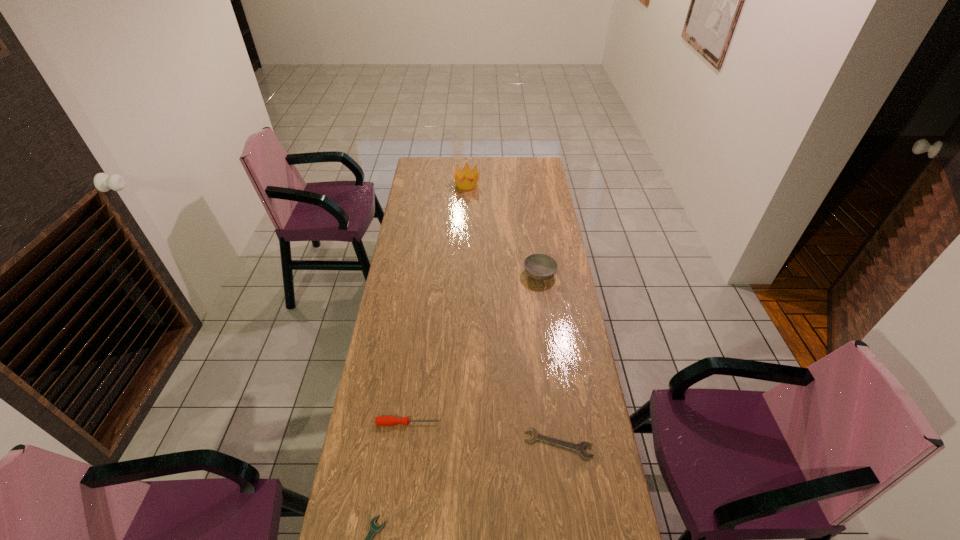
At what (x,y) coordinates should I click in order to perform the action: click on free location located at the tip of the third tallest object. Please return your answer as a coordinate pair (x, y). This screenshot has width=960, height=540. Looking at the image, I should click on (519, 423).

Locate an element on the screen. free space located on the front of the farther wrench is located at coordinates (568, 520).

I want to click on object present at the far edge, so click(466, 173).

At what (x,y) coordinates should I click in order to perform the action: click on object that is at the left edge. Please return your answer as a coordinate pair (x, y). Looking at the image, I should click on (380, 420).

Find the location of a particular element. bowl that is at the right edge is located at coordinates click(539, 266).

The image size is (960, 540). I want to click on wrench at the right edge, so click(580, 447).

Identify the location of vacant point at the far edge. This screenshot has height=540, width=960. (471, 162).

The width and height of the screenshot is (960, 540). Find the location of `free space at the left edge of the desktop`. free space at the left edge of the desktop is located at coordinates (397, 325).

The image size is (960, 540). Identify the location of vacant space at the right edge. (560, 264).

The height and width of the screenshot is (540, 960). Find the location of `vacant space that's between the crown and the third tallest object`. vacant space that's between the crown and the third tallest object is located at coordinates (438, 303).